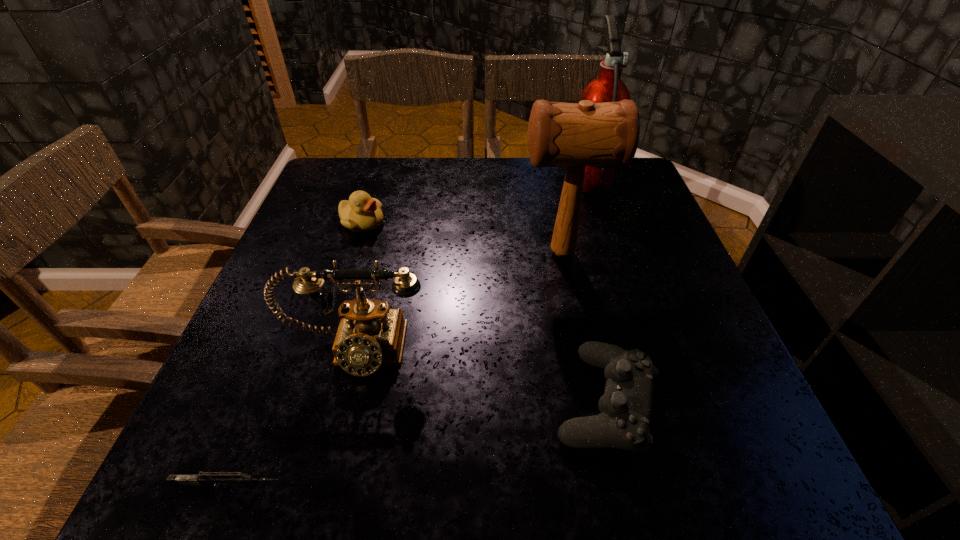
You are a GUI agent. You are given a task and a screenshot of the screen. Output one action in this format:
    pyautogui.click(x=<x>, y=<y>)
    Task: Click on the unoccupied area between the telephone and the mallet
    
    Given the screenshot: What is the action you would take?
    pyautogui.click(x=458, y=301)

The image size is (960, 540). In order to click on the fifth closest object to the mallet in this screenshot , I will do `click(218, 478)`.

Where is `object that stands as the closest to the shortest object`? This screenshot has width=960, height=540. object that stands as the closest to the shortest object is located at coordinates (371, 334).

Image resolution: width=960 pixels, height=540 pixels. In order to click on free space that satisfies the following two spatial constraints: 1. on the front side of the control; 2. aimed along the barrel of the gun in this screenshot , I will do `click(624, 487)`.

In order to click on vacant area that satisfies the following two spatial constraints: 1. on the dial number of the control; 2. on the left side of the telephone in this screenshot , I will do `click(341, 401)`.

The image size is (960, 540). I want to click on free location that satisfies the following two spatial constraints: 1. on the strike surface of the mallet; 2. on the left side of the control, so click(592, 401).

Locate an element on the screen. This screenshot has width=960, height=540. vacant space that satisfies the following two spatial constraints: 1. on the strike surface of the mallet; 2. on the dial number of the telephone is located at coordinates (582, 350).

Where is `free space in the image that satisfies the following two spatial constraints: 1. on the nozzle and handle of the farthest object; 2. on the dial number of the telephone`? free space in the image that satisfies the following two spatial constraints: 1. on the nozzle and handle of the farthest object; 2. on the dial number of the telephone is located at coordinates (645, 350).

Identify the location of free location that satisfies the following two spatial constraints: 1. on the dial number of the fourth shortest object; 2. aimed along the barrel of the nearest object. This screenshot has width=960, height=540. (319, 487).

Where is `vacant area in the image that satisfies the following two spatial constraints: 1. on the beak of the fifth tallest object; 2. on the right side of the duckling`? The image size is (960, 540). vacant area in the image that satisfies the following two spatial constraints: 1. on the beak of the fifth tallest object; 2. on the right side of the duckling is located at coordinates (306, 401).